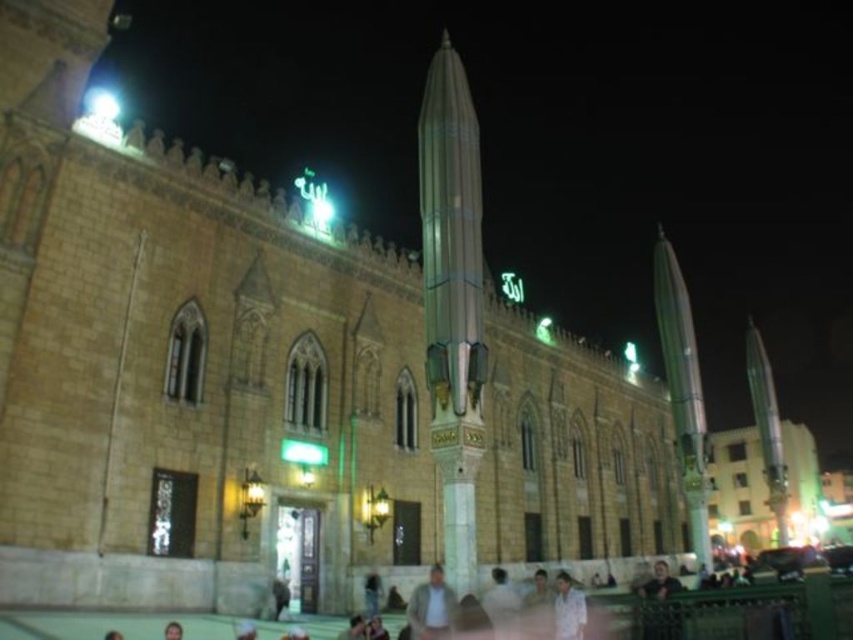
You are standing in front of the grand building and want to take a photo. There are two points marked on the building, point (473, 221) and point (413, 595). Which point is closer to your camera lens?

Point (473, 221) is further to the camera than point (413, 595), so the point closer to the camera lens is point (413, 595).

You are standing at the entrance of the grand building and want to take a photo of the green Arabic calligraphy signs on the roofline. The camera you are using has a focal length of 50mm. If the point corresponding to the calligraphy signs is located at point coordinates point (x=418, y=586), how far in meters should you stand from the building to ensure the calligraphy signs are in focus?

To ensure the green Arabic calligraphy signs on the roofline are in focus, you should stand 68.05 meters away from the building since the distance of point (x=418, y=586) from the camera is exactly 68.05 meters.